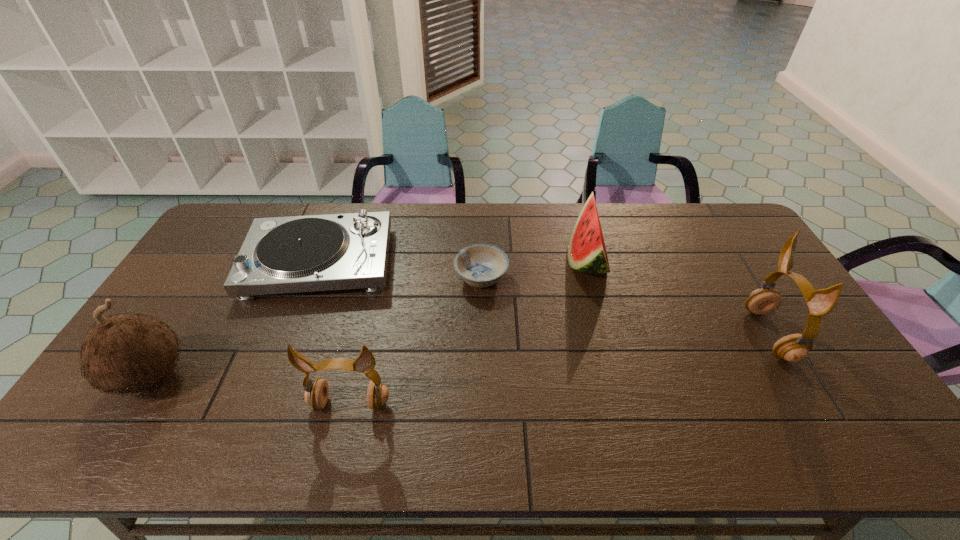
Locate an element on the screen. free location located 0.340m on the front-facing side of the right earphone is located at coordinates (633, 335).

At what (x,y) coordinates should I click in order to perform the action: click on vacant space located on the front-facing side of the right earphone. Please return your answer as a coordinate pair (x, y). This screenshot has height=540, width=960. Looking at the image, I should click on (721, 335).

In order to click on free space located 0.230m on the front-facing side of the right earphone in this screenshot , I will do `click(672, 335)`.

Identify the location of vacant space situated on the outer rind of the watermelon. (450, 260).

Locate an element on the screen. The width and height of the screenshot is (960, 540). free point located on the outer rind of the watermelon is located at coordinates (465, 260).

Where is `vacant space located on the outer rind of the watermelon`? The width and height of the screenshot is (960, 540). vacant space located on the outer rind of the watermelon is located at coordinates (518, 260).

You are a GUI agent. You are given a task and a screenshot of the screen. Output one action in this format:
    pyautogui.click(x=<x>, y=<y>)
    Task: Click on the vacant space located on the right of the record player
    
    Given the screenshot: What is the action you would take?
    pyautogui.click(x=471, y=262)

You are a GUI agent. You are given a task and a screenshot of the screen. Output one action in this format:
    pyautogui.click(x=<x>, y=<y>)
    Task: Click on the vacant space located 0.380m on the right of the shortest object
    The height and width of the screenshot is (540, 960).
    Given the screenshot: What is the action you would take?
    click(x=626, y=278)

Identify the location of watermelon at the far edge. The width and height of the screenshot is (960, 540). (587, 253).

Locate an element on the screen. Image resolution: width=960 pixels, height=540 pixels. record player present at the far edge is located at coordinates (293, 254).